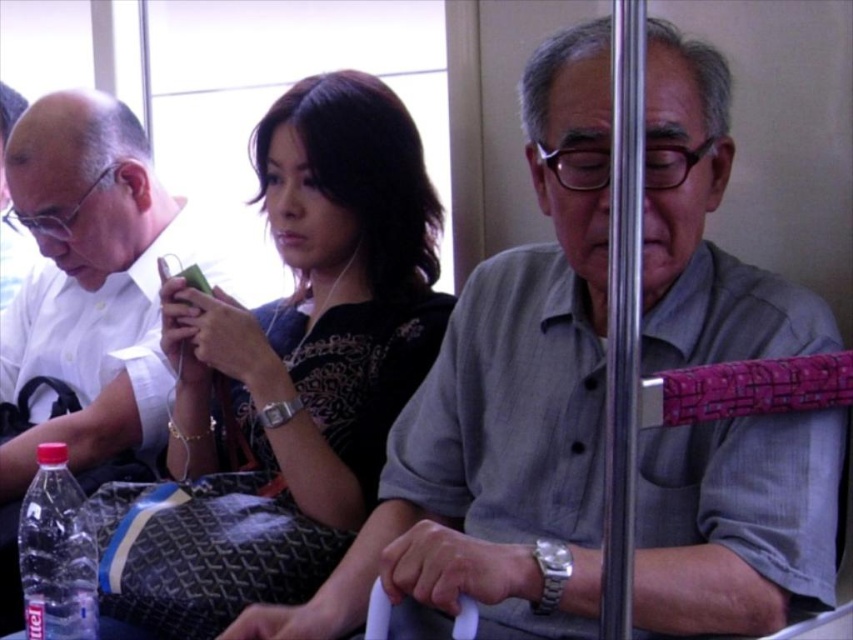
Question: Which object is farther from the camera taking this photo?

Choices:
 (A) matte black shirt at center
 (B) gray cotton shirt at center

Answer: (A)

Question: Is the position of gray cotton shirt at center less distant than that of matte black shirt at center?

Choices:
 (A) no
 (B) yes

Answer: (B)

Question: Is gray cotton shirt at center wider than matte black shirt at center?

Choices:
 (A) no
 (B) yes

Answer: (B)

Question: Where is gray cotton shirt at center located in relation to matte black shirt at center in the image?

Choices:
 (A) right
 (B) left

Answer: (A)

Question: Among these objects, which one is nearest to the camera?

Choices:
 (A) matte black shirt at center
 (B) gray cotton shirt at center

Answer: (B)